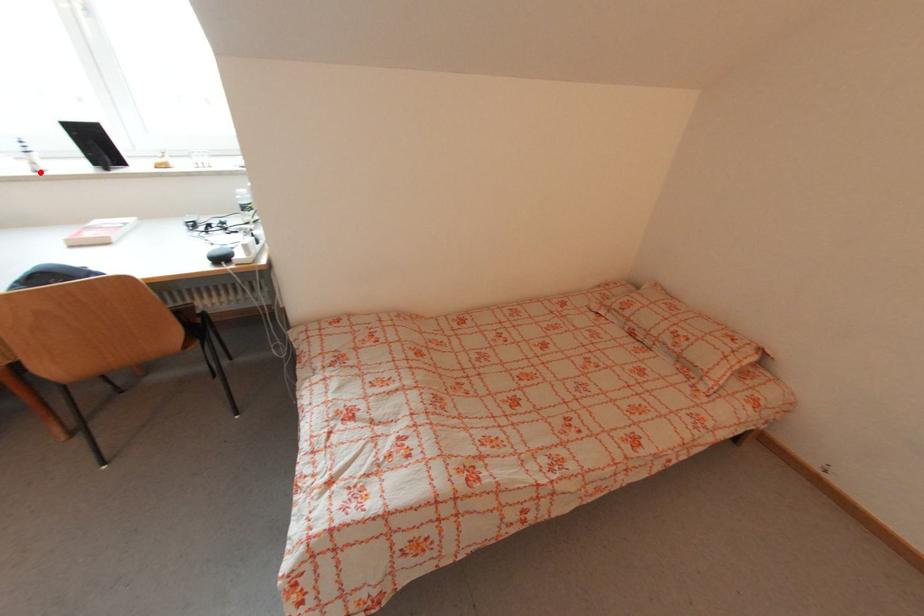
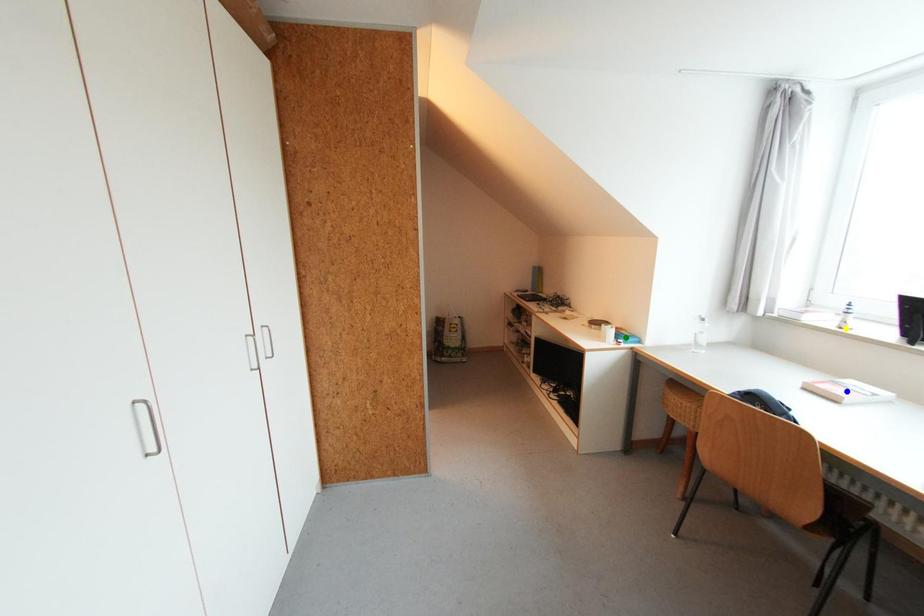
Question: I am providing you with two images of the same scene from different viewpoints. A red point is marked on the first image. You are given multiple points on the second image. In image 2, which mark is for the same physical point as the one in image 1?

Choices:
 (A) blue point
 (B) yellow point
 (C) green point

Answer: (B)